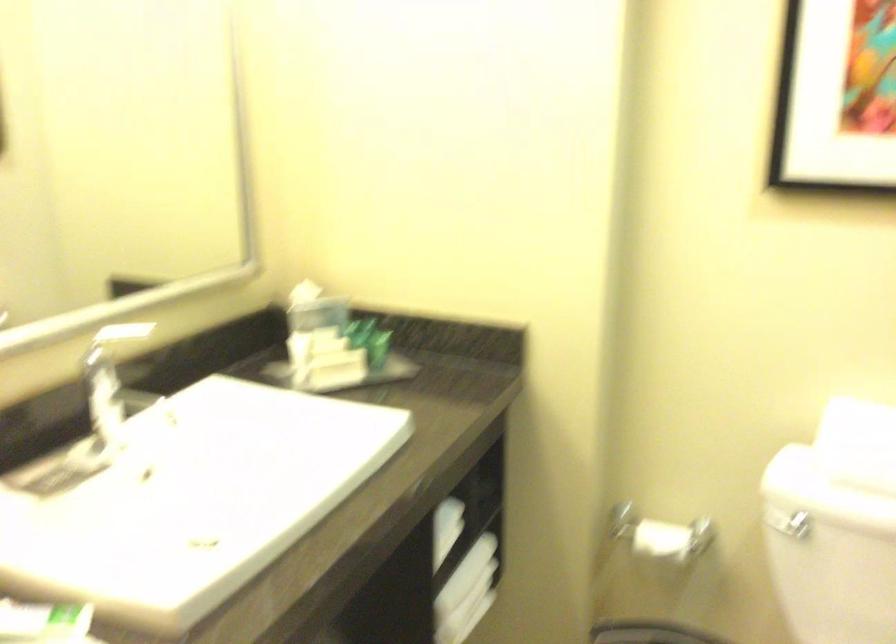
Find the location of `toilet flush handle`. toilet flush handle is located at coordinates (788, 524).